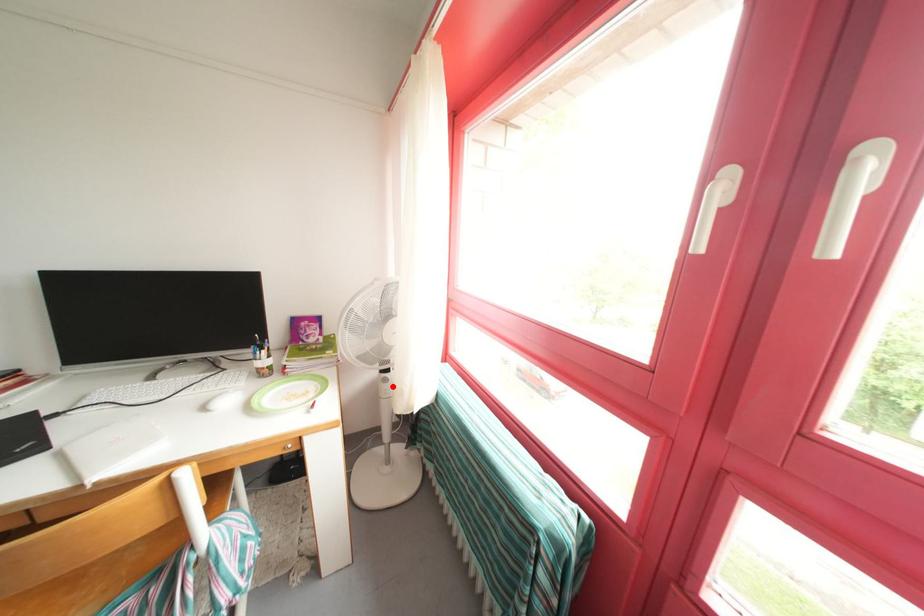
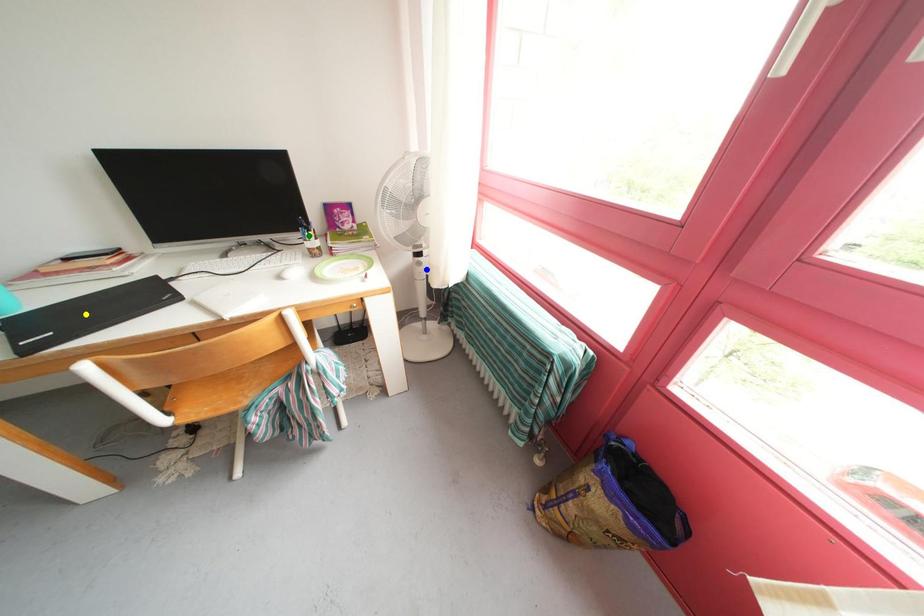
Question: I am providing you with two images of the same scene from different viewpoints. A red point is marked on the first image. You are given multiple points on the second image. In image 2, which mark is for the same physical point as the one in image 1?

Choices:
 (A) blue point
 (B) yellow point
 (C) green point

Answer: (A)